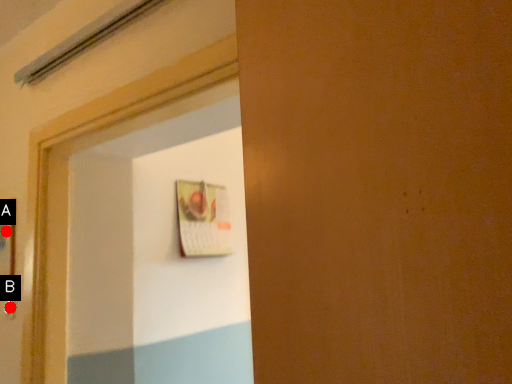
Question: Two points are circled on the image, labeled by A and B beside each circle. Which point is farther from the camera taking this photo?

Choices:
 (A) A is further
 (B) B is further

Answer: (A)